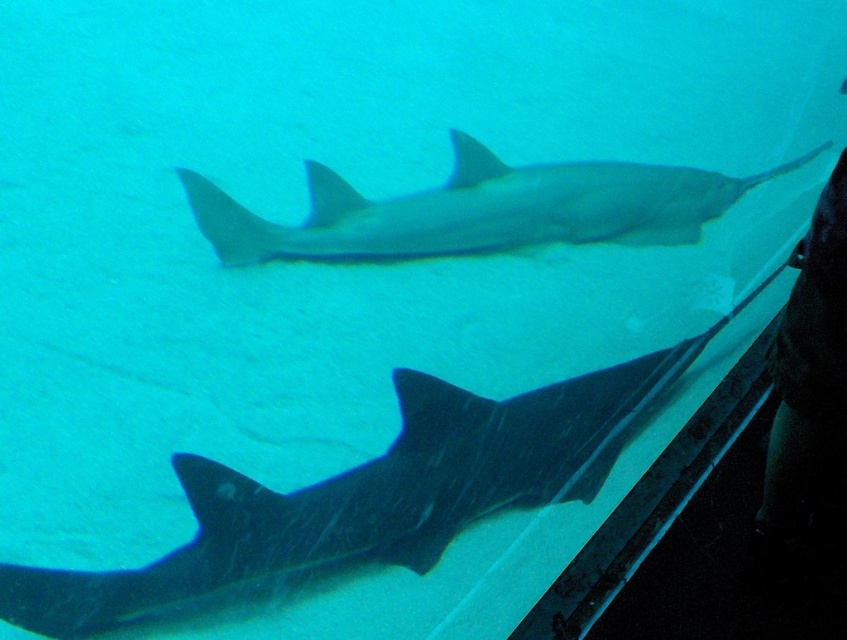
Question: Can you confirm if dark gray textured shark at center is positioned to the left of smooth gray shark at center?

Choices:
 (A) yes
 (B) no

Answer: (A)

Question: Is dark gray textured shark at center closer to the viewer compared to smooth gray shark at center?

Choices:
 (A) no
 (B) yes

Answer: (B)

Question: Which of the following is the closest to the observer?

Choices:
 (A) smooth gray shark at center
 (B) dark gray textured shark at center

Answer: (B)

Question: Does dark gray textured shark at center appear over smooth gray shark at center?

Choices:
 (A) yes
 (B) no

Answer: (B)

Question: Which point appears closest to the camera in this image?

Choices:
 (A) (153, 621)
 (B) (594, 163)

Answer: (A)